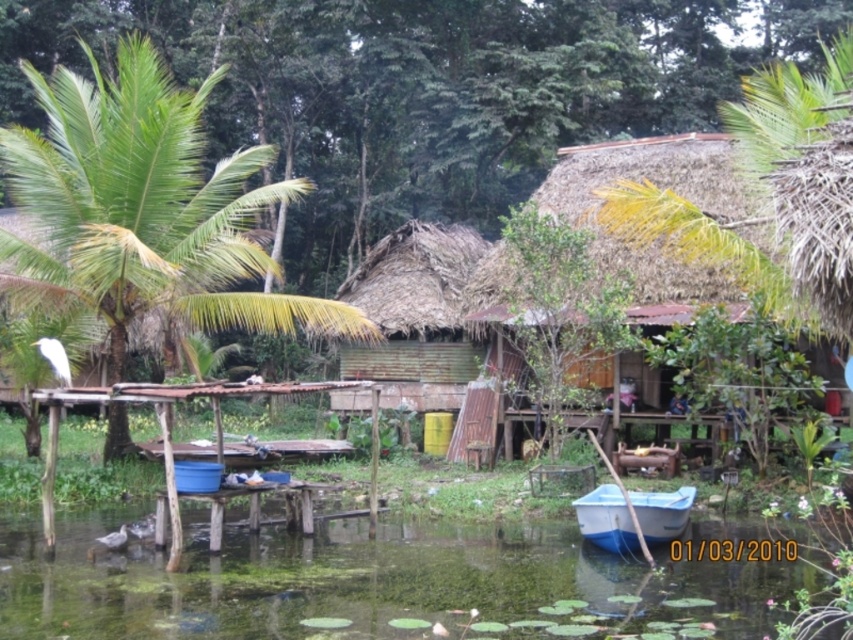
You are planning to build a small wooden dock extending from the shore into the green mossy water at lower center. The dock needs to be as wide as the green corrugated metal hut at center. Will the dock fit within the water area without overhanging?

The green mossy water at lower center is wider than the green corrugated metal hut at center, so the dock can be built to match the hut width and fit within the water area without overhanging.

You are planning to take a photo of the thatched straw hut at center and the green leafy palm tree at left. Which object should you focus on first if you want to capture both in a single frame without moving the camera?

The green leafy palm tree at left is larger than the thatched straw hut at center, so focusing on the palm tree first would ensure it fits well in the frame, allowing the hut to be included naturally.